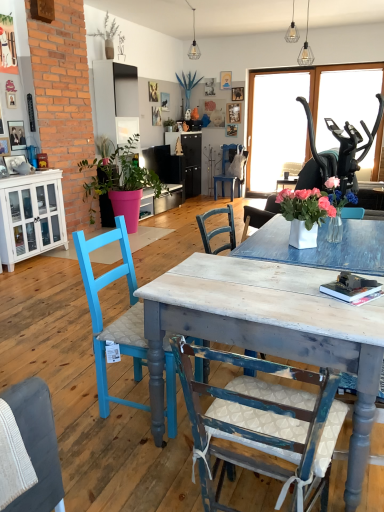
Question: Is clear glass pendant light at upper center, which is the third lamp from right to left, at the back of matte pink pot at left, marked as the first houseplant in a front-to-back arrangement?

Choices:
 (A) no
 (B) yes

Answer: (A)

Question: From a real-world perspective, does matte pink pot at left, the 1th houseplant in the bottom-to-top sequence, stand above clear glass pendant light at upper center, placed as the first lamp when sorted from back to front?

Choices:
 (A) yes
 (B) no

Answer: (B)

Question: Is matte pink pot at left, the 3th houseplant in the top-to-bottom sequence, bigger than clear glass pendant light at upper center, which is the third lamp from right to left?

Choices:
 (A) yes
 (B) no

Answer: (A)

Question: Can you confirm if matte pink pot at left, the 3th houseplant in the top-to-bottom sequence, is shorter than clear glass pendant light at upper center, which is counted as the first lamp, starting from the left?

Choices:
 (A) no
 (B) yes

Answer: (A)

Question: From the image's perspective, would you say matte pink pot at left, the 1th houseplant in the bottom-to-top sequence, is positioned over clear glass pendant light at upper center, the 3th lamp from the front?

Choices:
 (A) no
 (B) yes

Answer: (A)

Question: From a real-world perspective, is blue painted wood chair at left, which ranks as the third chair in bottom-to-top order, physically located above or below green matte plant at upper center, positioned as the second houseplant in front-to-back order?

Choices:
 (A) above
 (B) below

Answer: (B)

Question: Is blue painted wood chair at left, the second chair in the back-to-front sequence, bigger or smaller than green matte plant at upper center, positioned as the second houseplant in front-to-back order?

Choices:
 (A) small
 (B) big

Answer: (B)

Question: From the image's perspective, is blue painted wood chair at left, placed as the 2th chair when sorted from top to bottom, positioned above or below green matte plant at upper center, positioned as the 1th houseplant in top-to-bottom order?

Choices:
 (A) below
 (B) above

Answer: (A)

Question: Is point (137, 373) positioned closer to the camera than point (92, 33)?

Choices:
 (A) farther
 (B) closer

Answer: (B)

Question: Is blue painted wood chair at left, the second chair in the back-to-front sequence, to the left or to the right of transparent glass door at upper center in the image?

Choices:
 (A) left
 (B) right

Answer: (A)

Question: Is blue painted wood chair at left, placed as the 2th chair when sorted from top to bottom, inside or outside of transparent glass door at upper center?

Choices:
 (A) inside
 (B) outside

Answer: (B)

Question: Based on their sizes in the image, would you say blue painted wood chair at left, the second chair in the back-to-front sequence, is bigger or smaller than transparent glass door at upper center?

Choices:
 (A) big
 (B) small

Answer: (A)

Question: Considering the positions of blue painted wood chair at left, the third chair positioned from the front, and transparent glass door at upper center in the image, is blue painted wood chair at left, the third chair positioned from the front, taller or shorter than transparent glass door at upper center?

Choices:
 (A) tall
 (B) short

Answer: (B)

Question: Is green matte plant at upper center, placed as the 2th houseplant when sorted from top to bottom, inside the boundaries of black plastic exercise machine at upper right, or outside?

Choices:
 (A) inside
 (B) outside

Answer: (B)

Question: Would you say green matte plant at upper center, which appears as the 1th houseplant when viewed from the back, is to the left or to the right of black plastic exercise machine at upper right in the picture?

Choices:
 (A) right
 (B) left

Answer: (B)